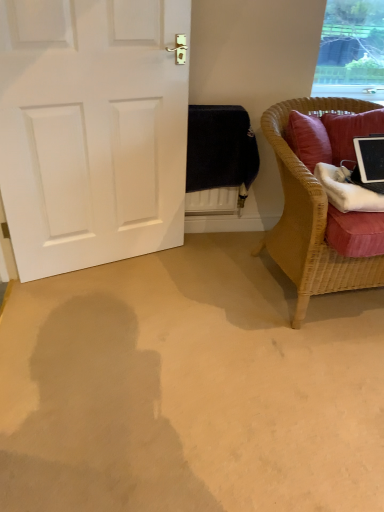
Question: Do you think white matte door at left is within transparent glass window at upper right, or outside of it?

Choices:
 (A) outside
 (B) inside

Answer: (A)

Question: From the image's perspective, is white matte door at left positioned above or below transparent glass window at upper right?

Choices:
 (A) below
 (B) above

Answer: (A)

Question: Which of these objects is positioned farthest from the white matte door at left?

Choices:
 (A) black glossy tablet at right
 (B) woven wicker chair at right
 (C) transparent glass window at upper right

Answer: (C)

Question: Estimate the real-world distances between objects in this image. Which object is closer to the white matte door at left?

Choices:
 (A) transparent glass window at upper right
 (B) woven wicker chair at right
 (C) black glossy tablet at right

Answer: (B)